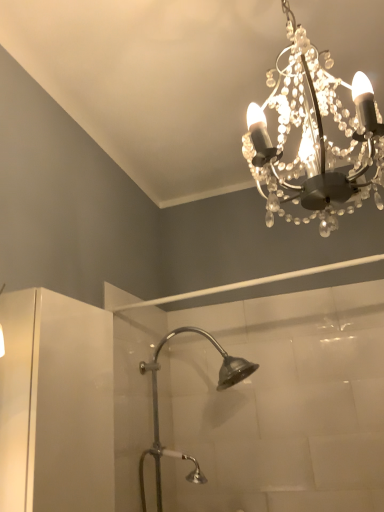
Question: Are clear crystal chandelier at upper center and silver metallic shower head at center far apart?

Choices:
 (A) no
 (B) yes

Answer: (B)

Question: Is clear crystal chandelier at upper center positioned in front of silver metallic shower head at center?

Choices:
 (A) no
 (B) yes

Answer: (B)

Question: Can you confirm if clear crystal chandelier at upper center is shorter than silver metallic shower head at center?

Choices:
 (A) yes
 (B) no

Answer: (A)

Question: Is clear crystal chandelier at upper center positioned with its back to silver metallic shower head at center?

Choices:
 (A) yes
 (B) no

Answer: (B)

Question: Does clear crystal chandelier at upper center have a greater height compared to silver metallic shower head at center?

Choices:
 (A) no
 (B) yes

Answer: (A)

Question: From a real-world perspective, is clear crystal chandelier at upper center positioned over silver metallic shower head at center based on gravity?

Choices:
 (A) yes
 (B) no

Answer: (A)

Question: Can you confirm if silver metallic shower head at center is shorter than clear crystal chandelier at upper center?

Choices:
 (A) no
 (B) yes

Answer: (A)

Question: Does silver metallic shower head at center have a smaller size compared to clear crystal chandelier at upper center?

Choices:
 (A) yes
 (B) no

Answer: (B)

Question: Is silver metallic shower head at center facing towards clear crystal chandelier at upper center?

Choices:
 (A) no
 (B) yes

Answer: (A)

Question: Is silver metallic shower head at center further to camera compared to clear crystal chandelier at upper center?

Choices:
 (A) no
 (B) yes

Answer: (B)

Question: Can you confirm if silver metallic shower head at center is thinner than clear crystal chandelier at upper center?

Choices:
 (A) yes
 (B) no

Answer: (B)

Question: From the image's perspective, is silver metallic shower head at center under clear crystal chandelier at upper center?

Choices:
 (A) yes
 (B) no

Answer: (A)

Question: From their relative heights in the image, would you say silver metallic shower head at center is taller or shorter than clear crystal chandelier at upper center?

Choices:
 (A) short
 (B) tall

Answer: (B)